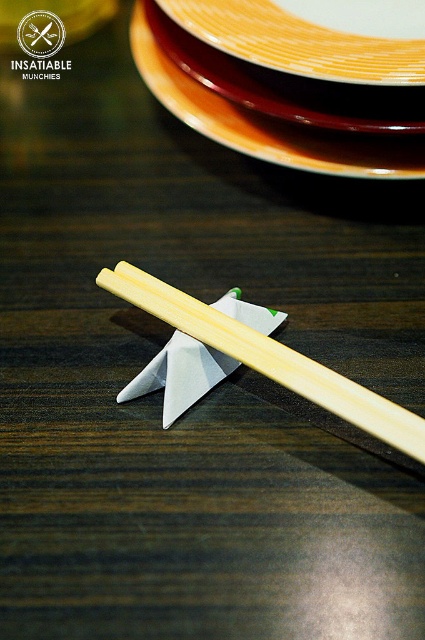
Does orange glazed plate at upper center have a lesser height compared to natural wood chopsticks at center?

Indeed, orange glazed plate at upper center has a lesser height compared to natural wood chopsticks at center.

Which of these two, orange glazed plate at upper center or natural wood chopsticks at center, stands taller?

With more height is natural wood chopsticks at center.

Where is `orange glazed plate at upper center`? This screenshot has height=640, width=425. orange glazed plate at upper center is located at coordinates (314, 35).

Who is more forward, (181,298) or (167,413)?

Point (167,413) is more forward.

Which of these two, natural wood chopsticks at center or wooden chopsticks at center, stands shorter?

Standing shorter between the two is wooden chopsticks at center.

Does point (303, 362) come closer to viewer compared to point (167, 355)?

Yes.

This screenshot has height=640, width=425. I want to click on natural wood chopsticks at center, so click(x=269, y=358).

Does orange glazed plate at upper center appear on the left side of wooden chopsticks at center?

Incorrect, orange glazed plate at upper center is not on the left side of wooden chopsticks at center.

Which is above, orange glazed plate at upper center or wooden chopsticks at center?

orange glazed plate at upper center is above.

This screenshot has height=640, width=425. In order to click on orange glazed plate at upper center in this screenshot , I will do `click(314, 35)`.

Image resolution: width=425 pixels, height=640 pixels. I want to click on orange glazed plate at upper center, so click(x=314, y=35).